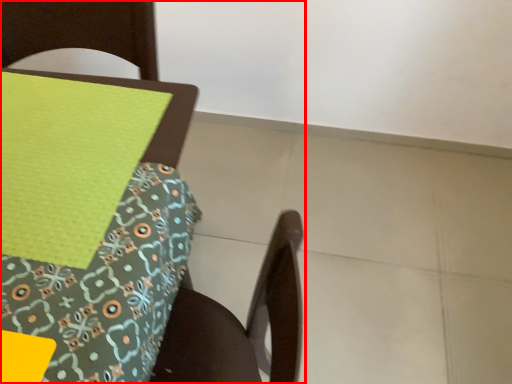
Question: From the image's perspective, considering the relative positions of chair (annotated by the red box) and sheet in the image provided, where is chair (annotated by the red box) located with respect to the staircase?

Choices:
 (A) below
 (B) above

Answer: (A)